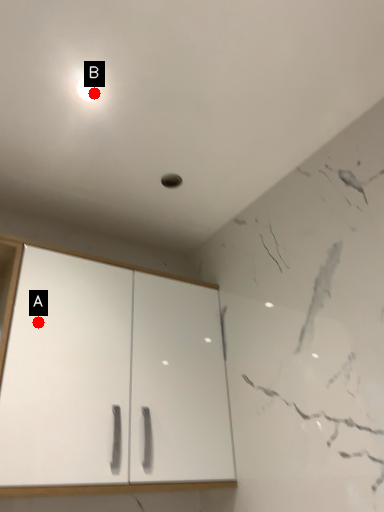
Question: Two points are circled on the image, labeled by A and B beside each circle. Which of the following is the closest to the observer?

Choices:
 (A) A is closer
 (B) B is closer

Answer: (B)